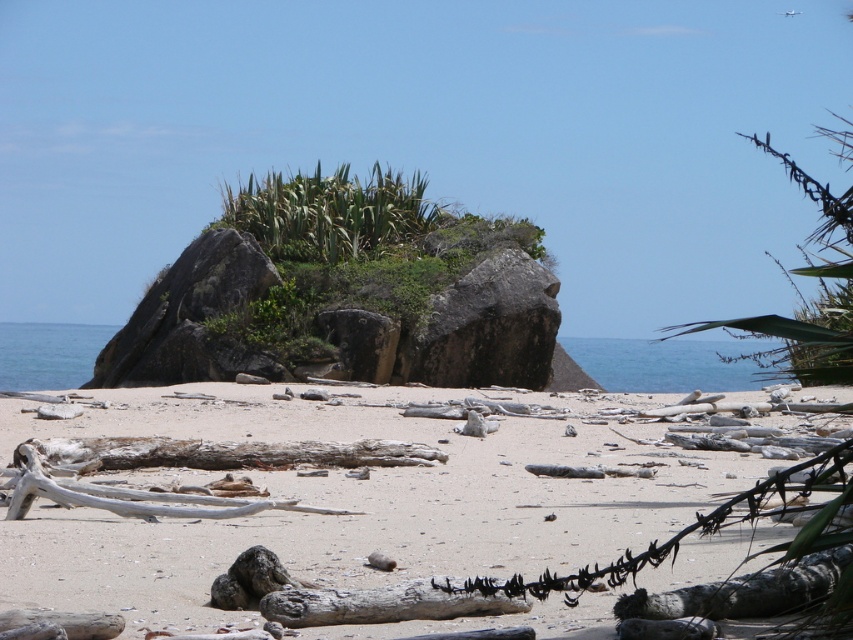
You are standing on the white sandy beach at center and want to reach the charcoal textured log at lower right. Which direction should you move to get closer to the log?

You should move backward because the white sandy beach at center is in front of the charcoal textured log at lower right, meaning the log is behind you relative to your current position on the beach.

You are standing at the origin point in the image. Which direction should you move to reach the white sandy beach at center?

The white sandy beach at center is located at coordinates point (349,502), so you should move towards the right and slightly forward to reach it.